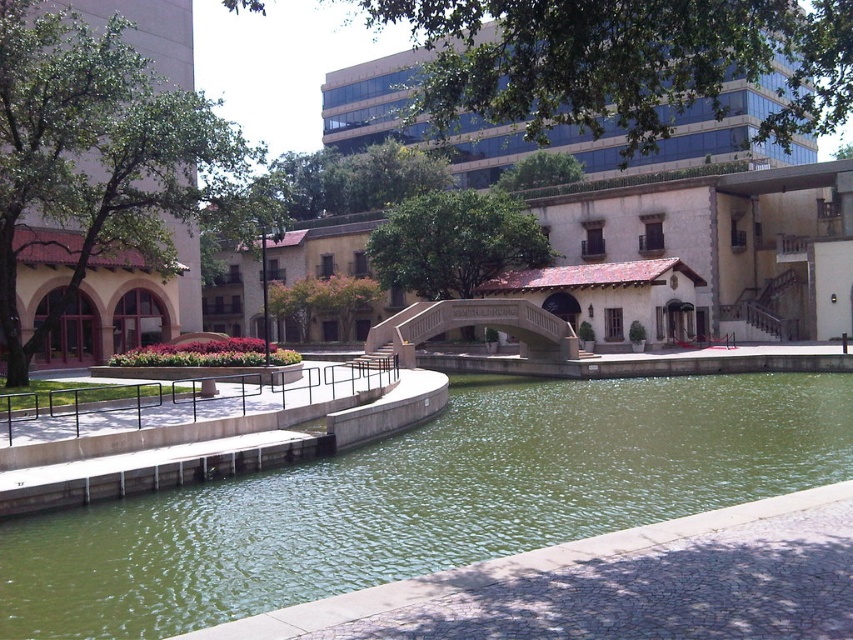
Question: Which point is farther to the camera?

Choices:
 (A) beige stone bridge at center
 (B) green concrete river at center

Answer: (A)

Question: Which point appears closest to the camera in this image?

Choices:
 (A) (421, 317)
 (B) (334, 563)

Answer: (B)

Question: Which point is closer to the camera?

Choices:
 (A) (448, 435)
 (B) (572, 352)

Answer: (A)

Question: Is green concrete river at center to the right of beige stone bridge at center from the viewer's perspective?

Choices:
 (A) yes
 (B) no

Answer: (A)

Question: From the image, what is the correct spatial relationship of green concrete river at center in relation to beige stone bridge at center?

Choices:
 (A) left
 (B) right

Answer: (B)

Question: Observing the image, what is the correct spatial positioning of green concrete river at center in reference to beige stone bridge at center?

Choices:
 (A) right
 (B) left

Answer: (A)